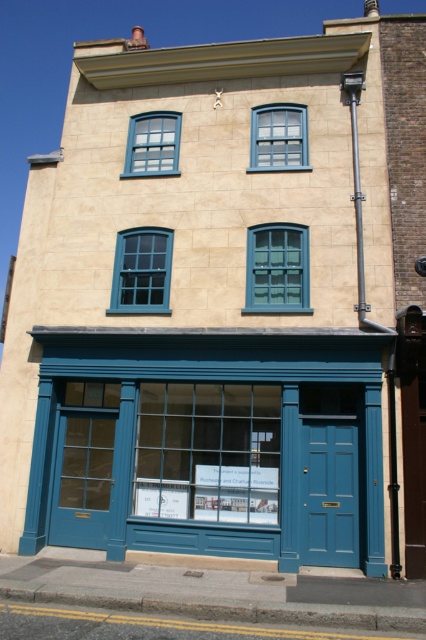
You are standing in front of the two story building described. There is a point marked at coordinates (189, 413). What object is located at this point?

The point at coordinates (189, 413) marks the matte blue storefront at center.

You are a delivery person with a 3.5 meter long ladder. You need to reach the matte teal glass window at center from the matte blue storefront at center. Can you safely place your ladder between them?

The distance between the matte blue storefront at center and the matte teal glass window at center is 4.13 meters. Since the ladder is only 3.5 meters long, it is too short to span the gap between them. You will need a longer ladder to safely reach the matte teal glass window at center.